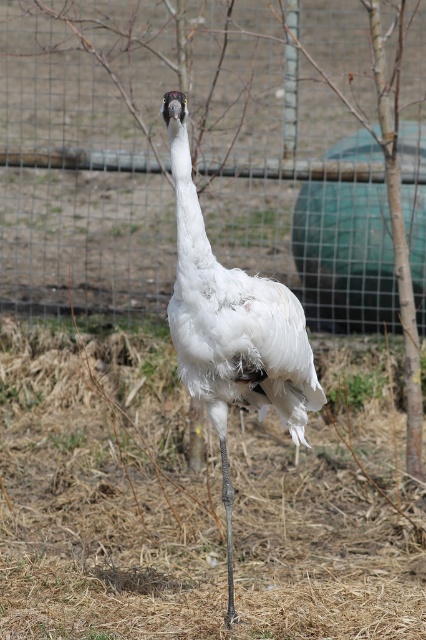
Looking at this image, between white fluffy hay at center and wire mesh fence at center, which one has more height?

wire mesh fence at center is taller.

Describe the element at coordinates (180, 509) in the screenshot. I see `white fluffy hay at center` at that location.

Identify the location of white fluffy hay at center. The height and width of the screenshot is (640, 426). pyautogui.click(x=180, y=509).

Does white fluffy hay at center appear on the left side of white feathered bird at center?

Yes, white fluffy hay at center is to the left of white feathered bird at center.

Is point (293, 547) positioned behind point (230, 332)?

Yes, point (293, 547) is behind point (230, 332).

At what (x,y) coordinates should I click in order to perform the action: click on white fluffy hay at center. Please return your answer as a coordinate pair (x, y). The width and height of the screenshot is (426, 640). Looking at the image, I should click on (180, 509).

Which is behind, point (334, 154) or point (176, 308)?

The point (334, 154) is more distant.

Can you confirm if wire mesh fence at center is bigger than white feathered bird at center?

Yes.

At what (x,y) coordinates should I click in order to perform the action: click on wire mesh fence at center. Please return your answer as a coordinate pair (x, y). The width and height of the screenshot is (426, 640). Looking at the image, I should click on (166, 147).